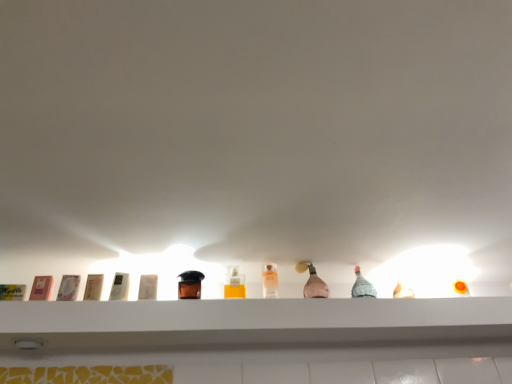
Question: From a real-world perspective, is white plastic container at center, the fourth toiletry from the left, located higher than pink glass bottle at center?

Choices:
 (A) no
 (B) yes

Answer: (A)

Question: From a real-world perspective, is white plastic container at center, the fourth toiletry from the left, below pink glass bottle at center?

Choices:
 (A) no
 (B) yes

Answer: (B)

Question: Is white plastic container at center, the fourth toiletry from the left, positioned far away from pink glass bottle at center?

Choices:
 (A) yes
 (B) no

Answer: (B)

Question: Could you tell me if white plastic container at center, which is the second toiletry in right-to-left order, is facing pink glass bottle at center?

Choices:
 (A) no
 (B) yes

Answer: (A)

Question: Is white plastic container at center, which is the second toiletry in right-to-left order, at the left side of pink glass bottle at center?

Choices:
 (A) yes
 (B) no

Answer: (A)

Question: Would you say brown leather toiletry at center, arranged as the fifth toiletry when viewed from the left, is inside or outside matte pink soap at left, which ranks as the first toiletry in left-to-right order?

Choices:
 (A) outside
 (B) inside

Answer: (A)

Question: From a real-world perspective, is brown leather toiletry at center, arranged as the 1th toiletry when viewed from the right, physically located above or below matte pink soap at left, which ranks as the first toiletry in left-to-right order?

Choices:
 (A) below
 (B) above

Answer: (B)

Question: Looking at the image, does brown leather toiletry at center, arranged as the fifth toiletry when viewed from the left, seem bigger or smaller compared to matte pink soap at left, which ranks as the 5th toiletry in right-to-left order?

Choices:
 (A) small
 (B) big

Answer: (B)

Question: From the image's perspective, is brown leather toiletry at center, arranged as the fifth toiletry when viewed from the left, positioned above or below matte pink soap at left, which ranks as the 5th toiletry in right-to-left order?

Choices:
 (A) below
 (B) above

Answer: (A)

Question: From the image's perspective, relative to pink glass bottle at center, is clear glass bottle at center, placed as the first bottle when sorted from left to right, above or below?

Choices:
 (A) below
 (B) above

Answer: (B)

Question: Is clear glass bottle at center, positioned as the second bottle in right-to-left order, to the left or to the right of pink glass bottle at center in the image?

Choices:
 (A) right
 (B) left

Answer: (B)

Question: Is point (238, 294) positioned closer to the camera than point (309, 268)?

Choices:
 (A) closer
 (B) farther

Answer: (A)

Question: Is clear glass bottle at center, placed as the first bottle when sorted from left to right, taller or shorter than pink glass bottle at center?

Choices:
 (A) tall
 (B) short

Answer: (B)

Question: In terms of height, does translucent glass bottle at center, the second bottle positioned from the left, look taller or shorter compared to brown leather toiletry at center, arranged as the 1th toiletry when viewed from the right?

Choices:
 (A) tall
 (B) short

Answer: (A)

Question: From the image's perspective, relative to brown leather toiletry at center, arranged as the 1th toiletry when viewed from the right, is translucent glass bottle at center, which appears as the 1th bottle when viewed from the right, above or below?

Choices:
 (A) below
 (B) above

Answer: (A)